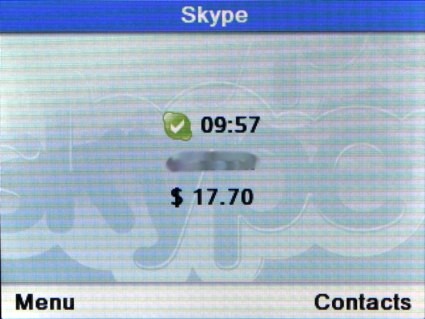
This screenshot has height=319, width=425. What are the coordinates of `window` in the screenshot? It's located at (271, 13).